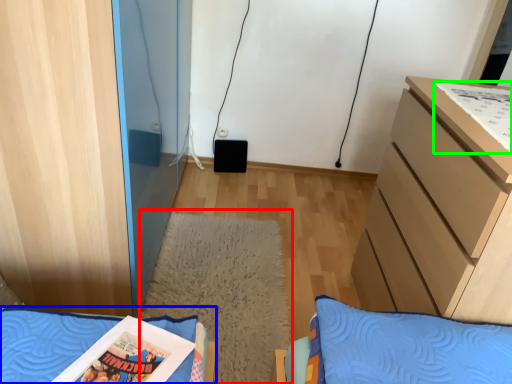
Question: Which object is positioned closest to mat (highlighted by a red box)? Select from furniture (highlighted by a blue box) and comic book (highlighted by a green box).

Choices:
 (A) furniture
 (B) comic book

Answer: (A)